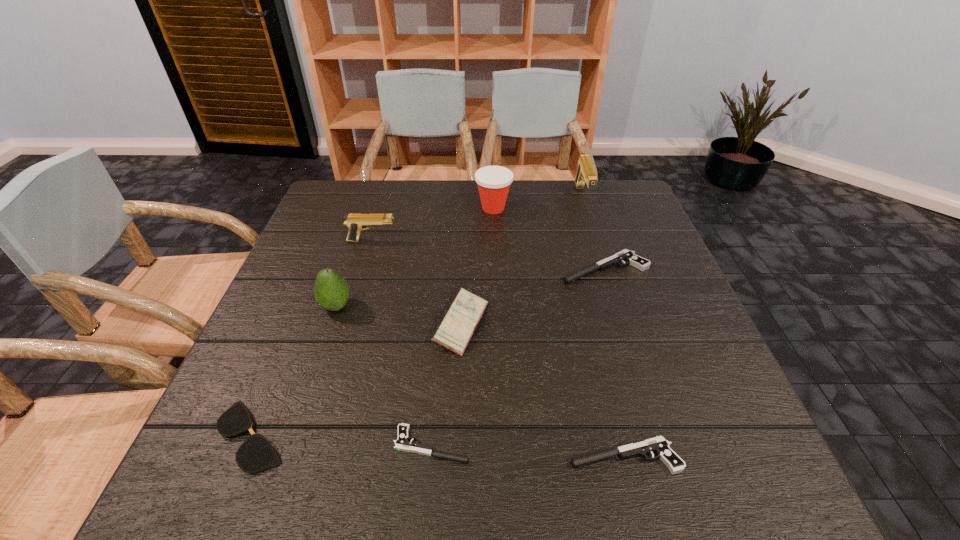
Where is `blank area located 0.190m on the front-facing side of the farthest black pistol`? Image resolution: width=960 pixels, height=540 pixels. blank area located 0.190m on the front-facing side of the farthest black pistol is located at coordinates (485, 268).

This screenshot has height=540, width=960. I want to click on free location located on the front-facing side of the farthest black pistol, so click(485, 268).

Locate an element on the screen. The image size is (960, 540). vacant position located on the front-facing side of the fourth tallest pistol is located at coordinates pos(458,456).

Find the location of `vacant area located on the front-facing side of the fourth tallest pistol`. vacant area located on the front-facing side of the fourth tallest pistol is located at coordinates (488, 456).

Identify the location of vacant area situated 0.070m on the front-facing side of the fourth tallest pistol. (529, 456).

Locate an element on the screen. vacant position located 0.190m on the right of the spectacles is located at coordinates (398, 436).

This screenshot has width=960, height=540. I want to click on vacant region located on the front-facing side of the fourth pistol from right to left, so click(256, 444).

Identify the location of free spot located on the front-facing side of the fourth pistol from right to left. The height and width of the screenshot is (540, 960). click(216, 444).

This screenshot has height=540, width=960. I want to click on blank area located 0.250m on the front-facing side of the fourth pistol from right to left, so click(x=251, y=444).

Identify the location of pistol located at the far edge. The width and height of the screenshot is (960, 540). (585, 173).